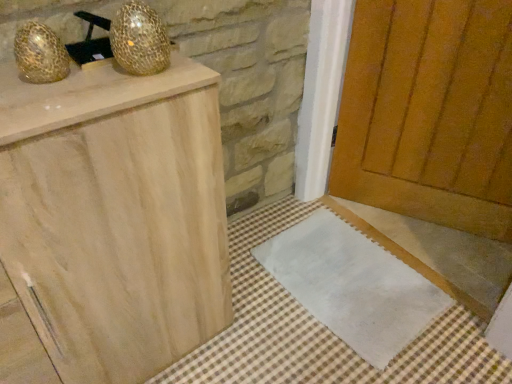
Locate an element on the screen. unoccupied region to the right of gold textured egg at upper left, the second disco ball viewed from the right is located at coordinates (126, 80).